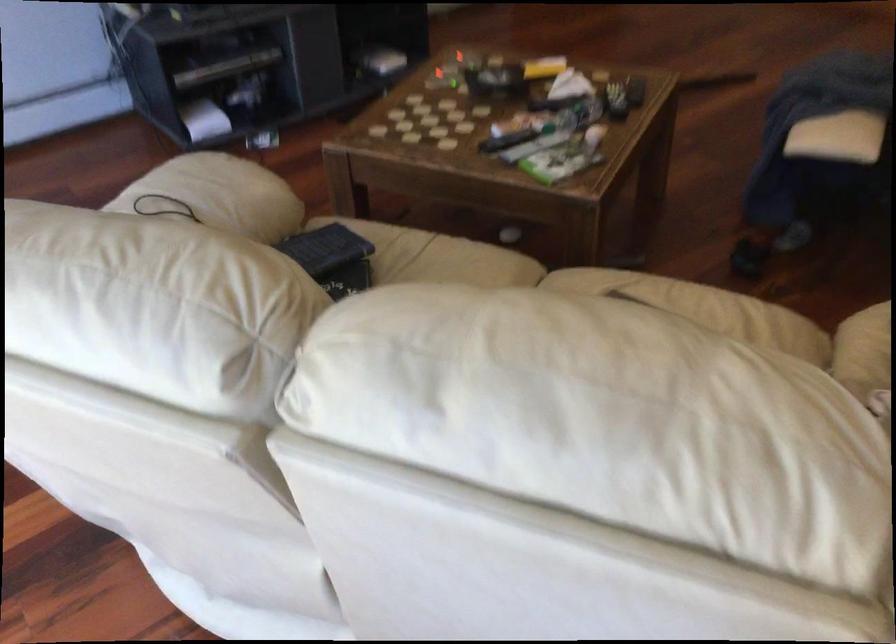
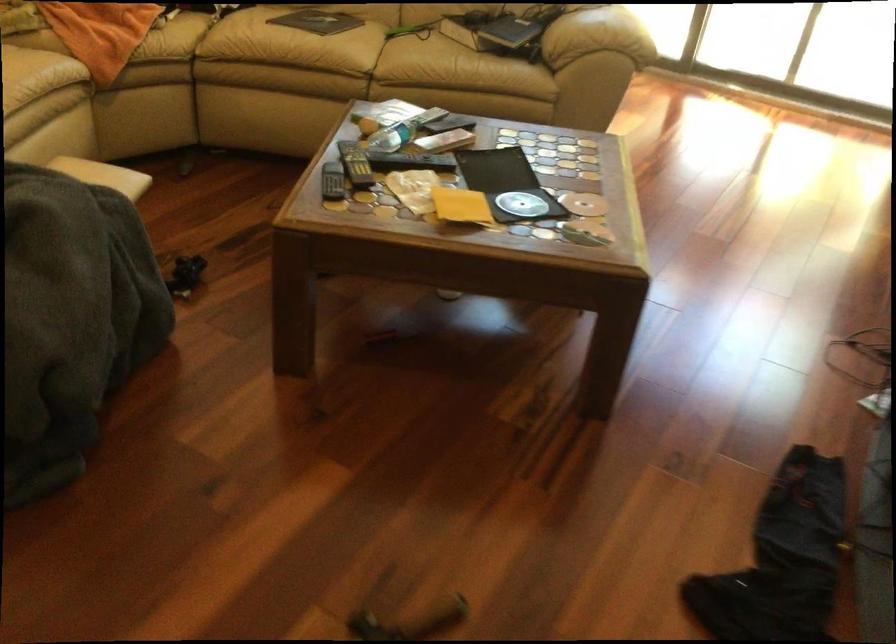
Question: I am providing you with two images of the same scene from different viewpoints. Please identify which objects are invisible in image2.

Choices:
 (A) sofa sitting surface
 (B) black remote control
 (C) open DVD case
 (D) none of these

Answer: (D)